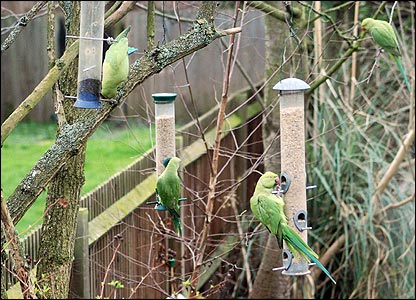
This screenshot has width=416, height=300. Find the location of `pampas grass`. pampas grass is located at coordinates (345, 157), (368, 164), (377, 93), (396, 231).